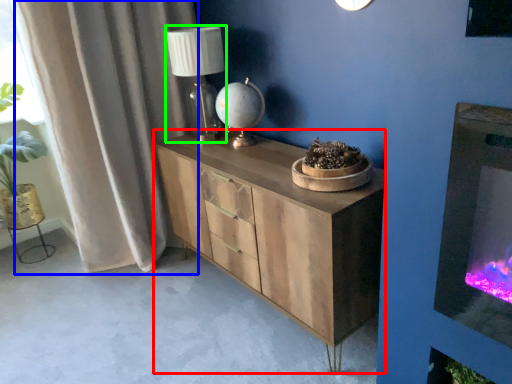
Question: Which object is the closest to the chest of drawers (highlighted by a red box)? Choose among these: curtain (highlighted by a blue box) or table lamp (highlighted by a green box).

Choices:
 (A) curtain
 (B) table lamp

Answer: (B)